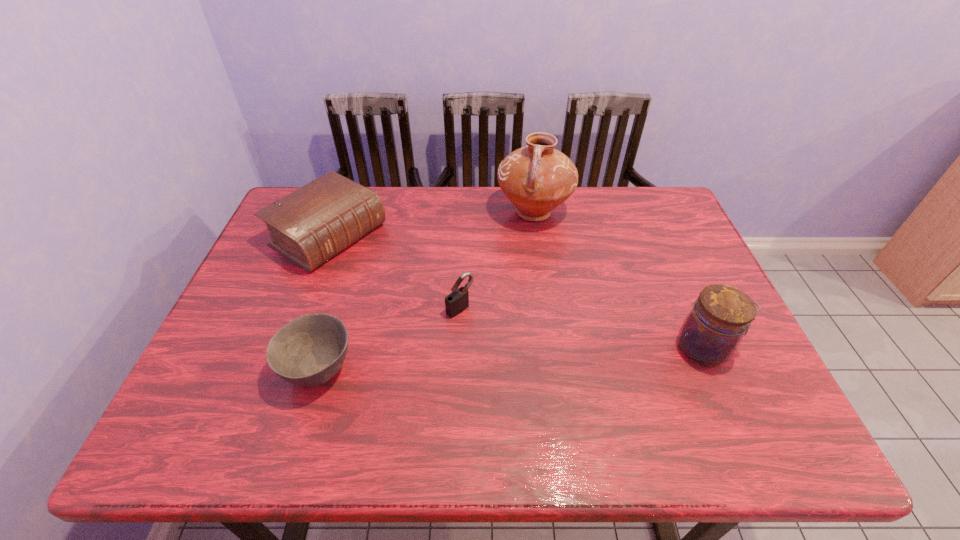
Where is `free space on the desktop that is between the bowl and the fourth shortest object and is positioned on the side of the tallest object with the handle`? The width and height of the screenshot is (960, 540). free space on the desktop that is between the bowl and the fourth shortest object and is positioned on the side of the tallest object with the handle is located at coordinates 467,361.

At what (x,y) coordinates should I click in order to perform the action: click on free space on the desktop that is between the bowl and the rightmost object and is positioned with the keyhole on the front of the padlock. Please return your answer as a coordinate pair (x, y). The image size is (960, 540). Looking at the image, I should click on (520, 359).

The width and height of the screenshot is (960, 540). In order to click on free space on the desktop that is between the bowl and the fourth shortest object and is positioned on the spine side of the Bible in this screenshot , I will do 527,358.